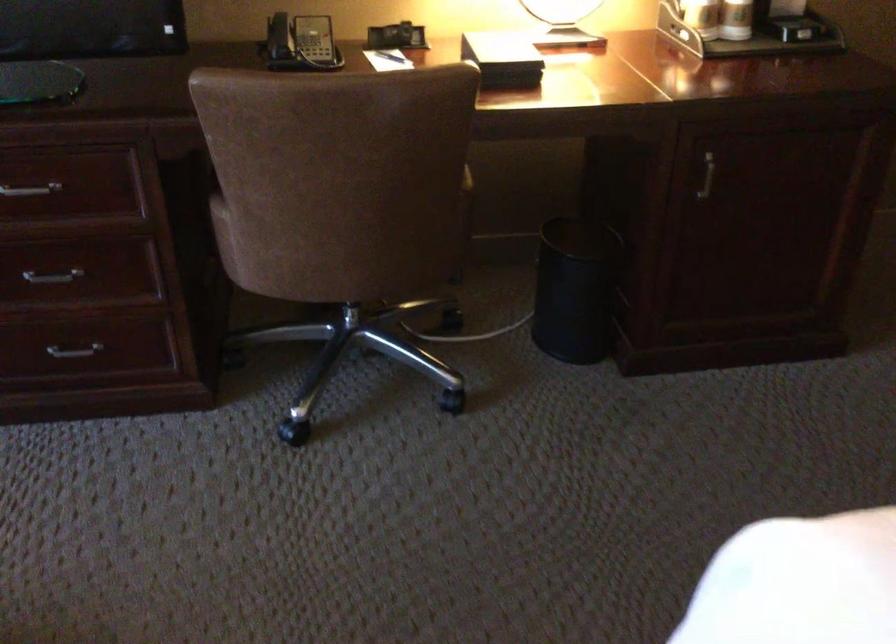
What do you see at coordinates (30, 191) in the screenshot?
I see `a silver cabinet handle` at bounding box center [30, 191].